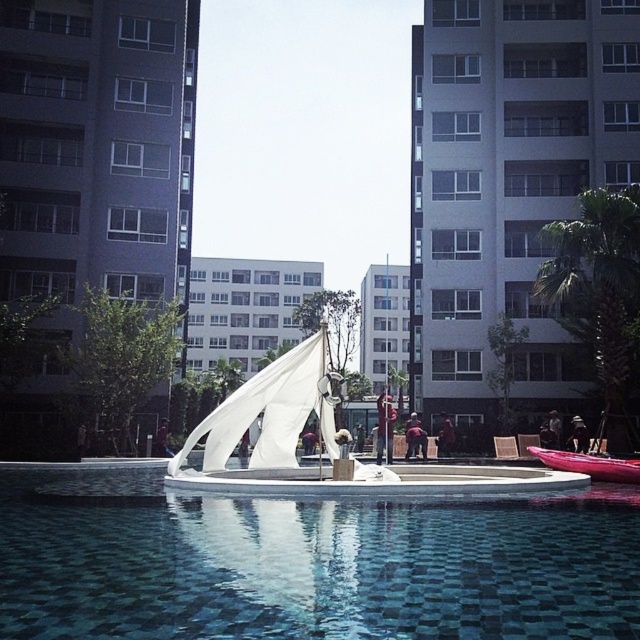
You are standing at the edge of the pool and want to place a floating dock between the blue glossy water at center and the shiny red canoe at lower right. Since the dock needs to be placed where the water is deeper, which area should you choose?

The blue glossy water at center is deeper than the shiny red canoe at lower right because it is taller, so you should place the floating dock there.